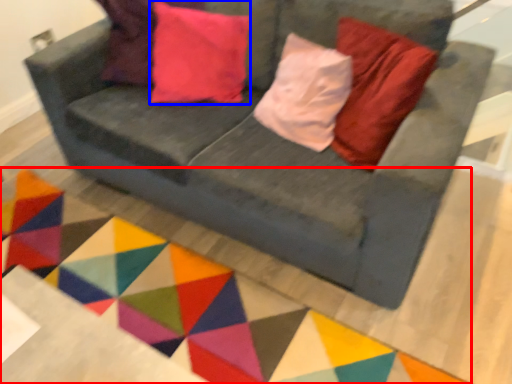
Question: Among these objects, which one is nearest to the camera, mat (highlighted by a red box) or pillow (highlighted by a blue box)?

Choices:
 (A) mat
 (B) pillow

Answer: (A)